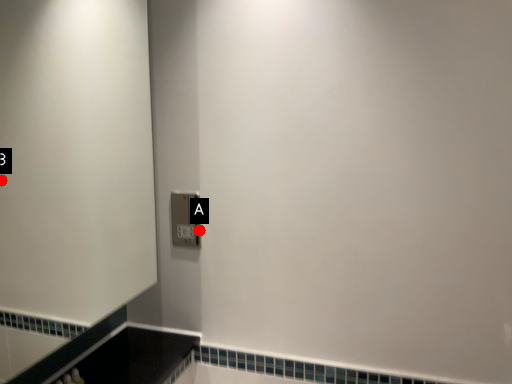
Question: Two points are circled on the image, labeled by A and B beside each circle. Which of the following is the closest to the observer?

Choices:
 (A) A is closer
 (B) B is closer

Answer: (A)